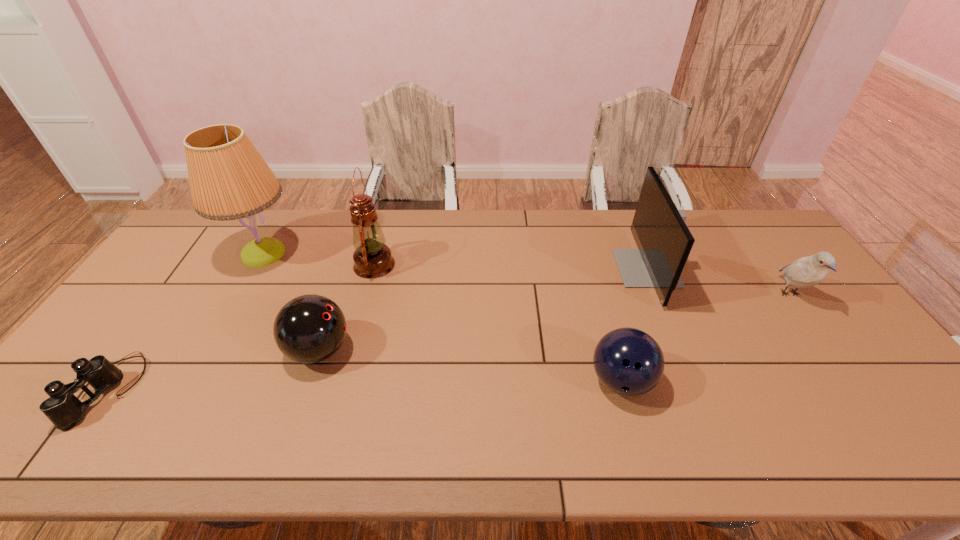
The height and width of the screenshot is (540, 960). In order to click on free space at the far right corner of the desktop in this screenshot , I will do `click(748, 213)`.

Find the location of a particular element. This screenshot has width=960, height=540. vacant space in between the bird and the leftmost object is located at coordinates click(450, 342).

I want to click on vacant region between the third object from right to left and the lamp, so click(x=443, y=318).

Locate an element on the screen. This screenshot has height=540, width=960. free space between the bird and the computer monitor is located at coordinates (718, 281).

This screenshot has height=540, width=960. I want to click on vacant point located between the left bowling ball and the binoculars, so click(214, 370).

Where is `empty location between the third tallest object and the tallest object`? This screenshot has width=960, height=540. empty location between the third tallest object and the tallest object is located at coordinates (455, 261).

Find the location of `free space between the left bowling ball and the oil lamp`. free space between the left bowling ball and the oil lamp is located at coordinates (347, 307).

Locate an element on the screen. free space between the shortest object and the left bowling ball is located at coordinates (214, 370).

The image size is (960, 540). Identify the location of free space between the sixth object from left to right and the oil lamp. (511, 267).

Locate an element on the screen. The image size is (960, 540). unoccupied area between the fifth object from left to right and the left bowling ball is located at coordinates (470, 366).